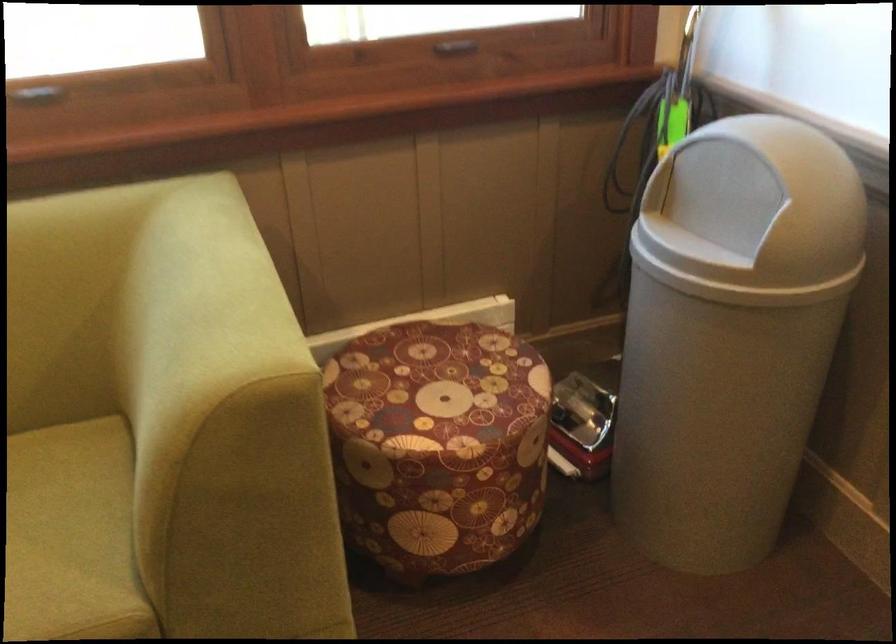
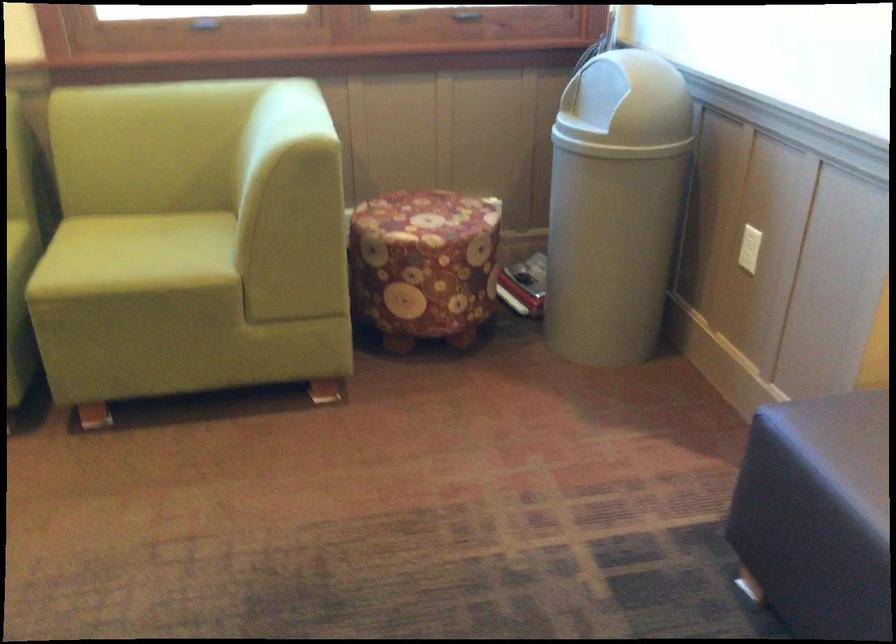
In the second image, find the point that corresponds to point 719,203 in the first image.

(598, 99)